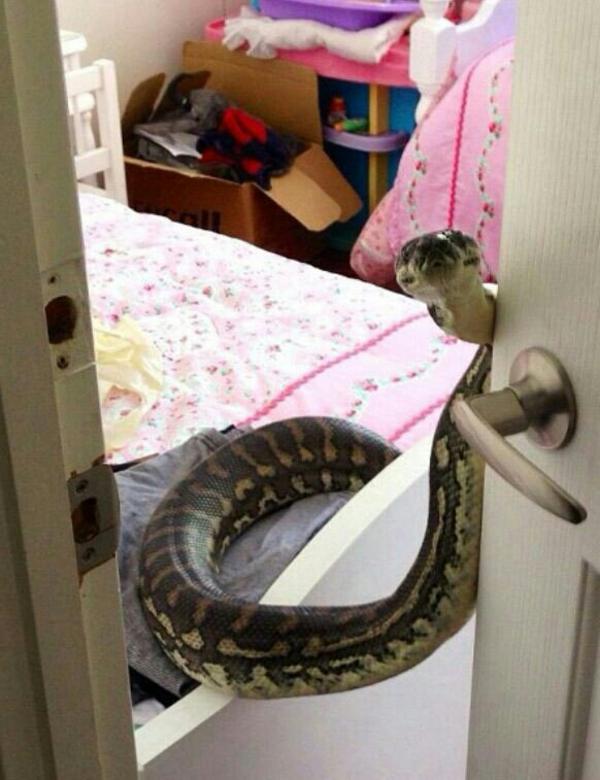
Image resolution: width=600 pixels, height=780 pixels. I want to click on baby bath, so click(350, 18).